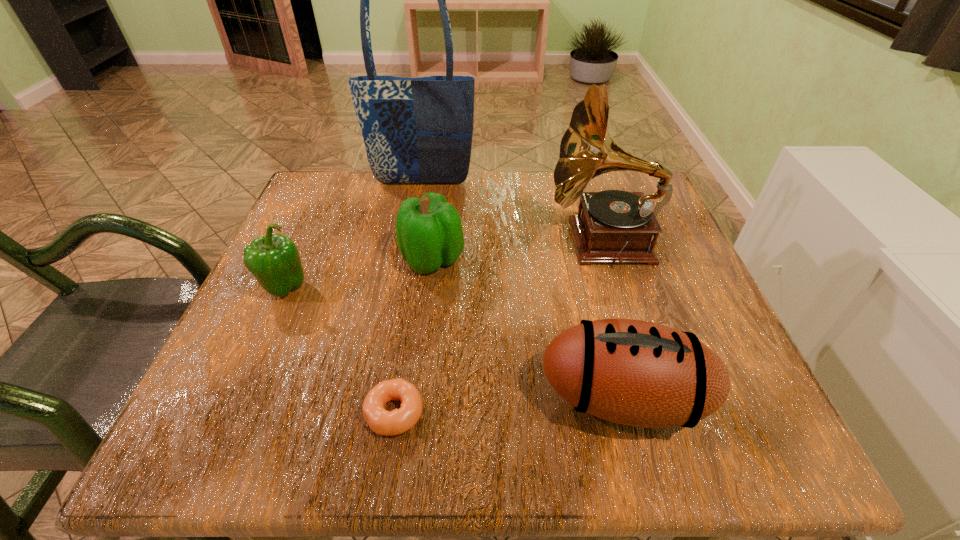
You are a GUI agent. You are given a task and a screenshot of the screen. Output one action in this format:
    pyautogui.click(x=<x>, y=<y>)
    Task: Click on the fifth closest object relative to the right bell pepper
    
    Given the screenshot: What is the action you would take?
    pyautogui.click(x=382, y=422)

Locate an element on the screen. This screenshot has width=960, height=540. vacant space that satisfies the following two spatial constraints: 1. on the front-facing side of the shopping bag; 2. on the left side of the right bell pepper is located at coordinates (409, 259).

Find the location of a particular element. This screenshot has width=960, height=540. free space that satisfies the following two spatial constraints: 1. on the front-facing side of the farthest object; 2. on the left side of the right bell pepper is located at coordinates (409, 259).

You are a GUI agent. You are given a task and a screenshot of the screen. Output one action in this format:
    pyautogui.click(x=<x>, y=<y>)
    Task: Click on the vacant region that satisfies the following two spatial constraints: 1. on the back side of the shortest object; 2. on the right side of the football (American)
    The height and width of the screenshot is (540, 960).
    Given the screenshot: What is the action you would take?
    pyautogui.click(x=396, y=398)

Where is `free space that satisfies the following two spatial constraints: 1. on the back side of the football (American); 2. on the left side of the shortest object`? free space that satisfies the following two spatial constraints: 1. on the back side of the football (American); 2. on the left side of the shortest object is located at coordinates (396, 398).